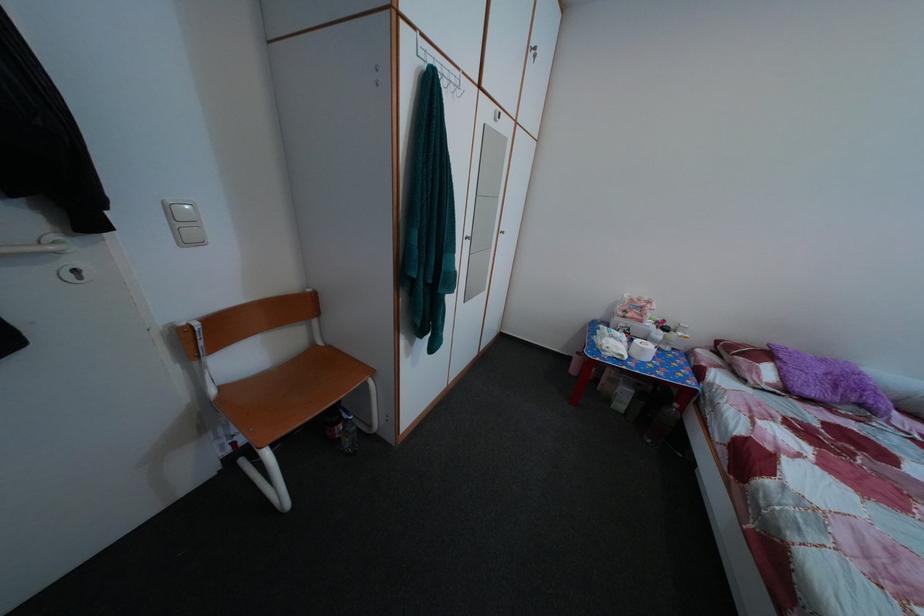
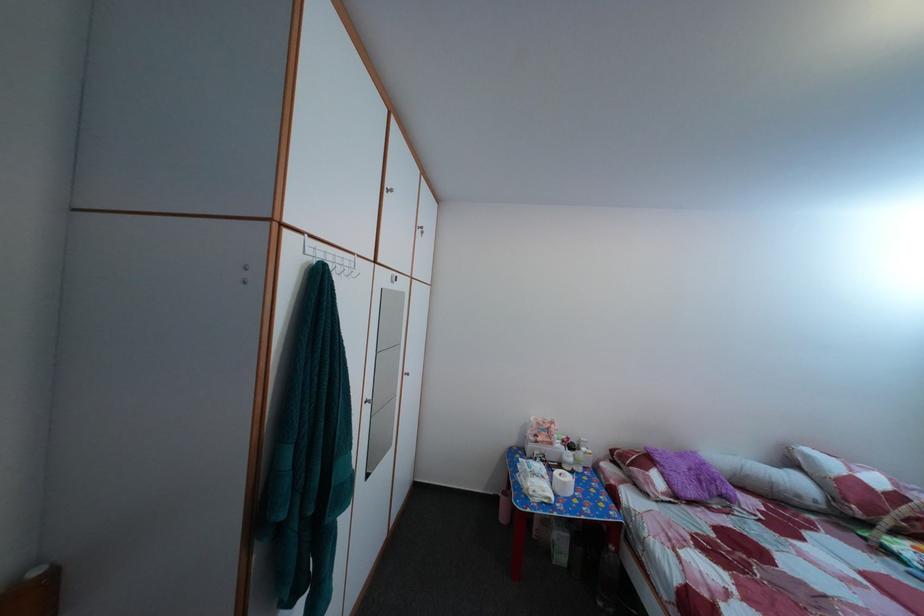
Find the pixel in the second image that matches pixel 674 329 in the first image.

(578, 447)